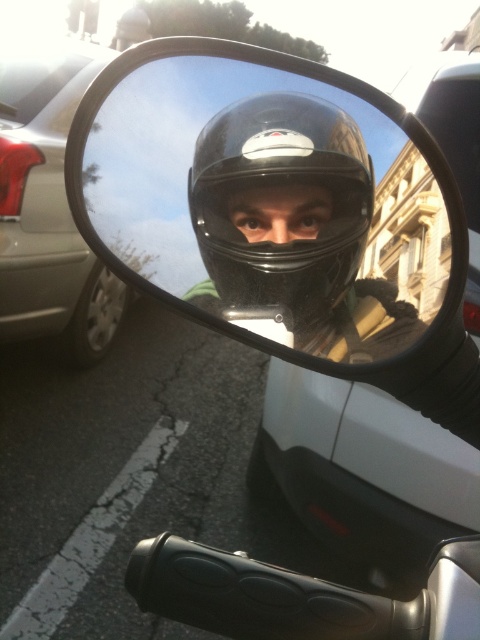
You are riding a motorcycle and looking at the rearview mirror. You notice the transparent plastic mirror at center and the matte black helmet at center. Which object is positioned higher?

The transparent plastic mirror at center is above the matte black helmet at center, so it is positioned higher.

You are a rider checking your rearview mirror. The mirror is at the center of your view. If your eyes are positioned at coordinates 0.3, 0.5 in this view, is the transparent plastic mirror at center located directly in front of your eyes?

The transparent plastic mirror at center is located at point [267,188], which is very close to the rider eyes at [240,192]. Therefore, it is directly in front of the rider eyes.